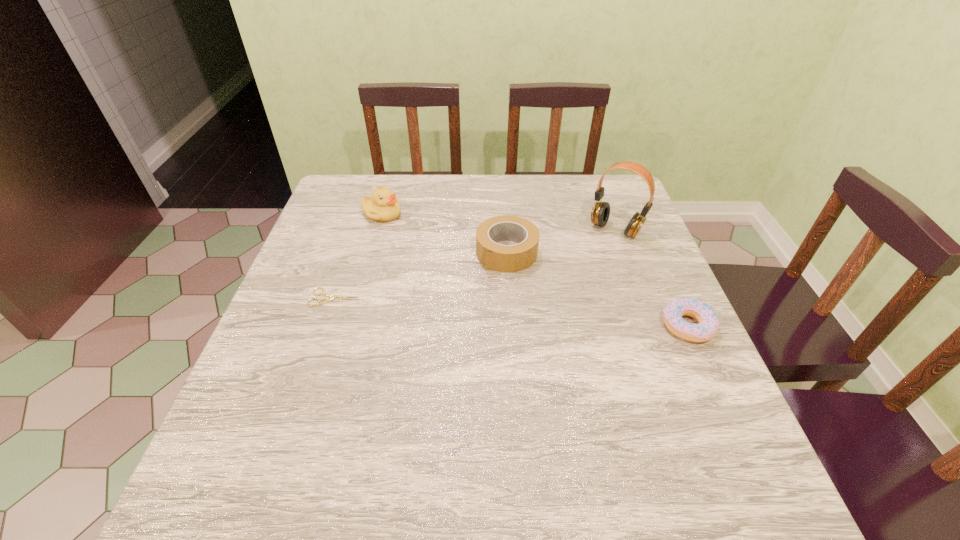
In the image, there is a desktop. Where is `vacant space at the right edge`? This screenshot has width=960, height=540. vacant space at the right edge is located at coordinates (646, 234).

This screenshot has width=960, height=540. I want to click on vacant space at the far left corner of the desktop, so click(x=339, y=206).

Where is `free space at the far right corner of the desktop`? free space at the far right corner of the desktop is located at coordinates (624, 214).

In order to click on free space at the near right corner of the desktop in this screenshot , I will do `click(730, 416)`.

This screenshot has width=960, height=540. I want to click on vacant space that's between the third tallest object and the headset, so click(x=561, y=241).

Locate an element on the screen. Image resolution: width=960 pixels, height=540 pixels. free space between the fourth shortest object and the nearest object is located at coordinates (535, 271).

Identify the location of free spot between the duct tape and the fourth farthest object. 420,275.

You are a GUI agent. You are given a task and a screenshot of the screen. Output one action in this format:
    pyautogui.click(x=<x>, y=<y>)
    Task: Click on the blank region between the third object from right to left and the shears
    The height and width of the screenshot is (540, 960).
    Given the screenshot: What is the action you would take?
    pyautogui.click(x=420, y=275)

At what (x,y) coordinates should I click in order to perform the action: click on free area in between the headset and the shortest object. Please return your answer as a coordinate pair (x, y). This screenshot has height=540, width=960. Looking at the image, I should click on (475, 264).

Image resolution: width=960 pixels, height=540 pixels. Find the location of `free space between the shears and the second tallest object`. free space between the shears and the second tallest object is located at coordinates (358, 256).